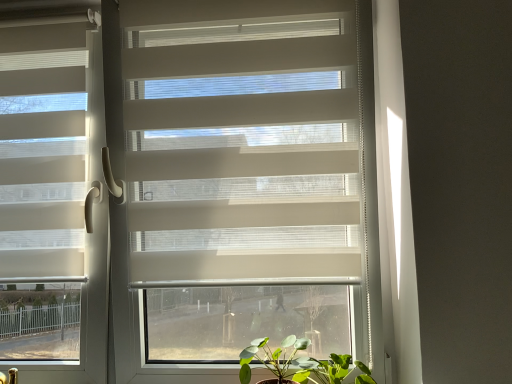
Question: Which is correct: green matte plant at lower center is inside green leafy plant at lower center, or outside of it?

Choices:
 (A) inside
 (B) outside

Answer: (B)

Question: Considering the positions of green matte plant at lower center and green leafy plant at lower center in the image, is green matte plant at lower center wider or thinner than green leafy plant at lower center?

Choices:
 (A) thin
 (B) wide

Answer: (A)

Question: Which is nearer to the matte white blinds at left?

Choices:
 (A) green leafy plant at lower center
 (B) green matte plant at lower center

Answer: (B)

Question: Based on their relative distances, which object is nearer to the green matte plant at lower center?

Choices:
 (A) green leafy plant at lower center
 (B) matte white blinds at left

Answer: (A)